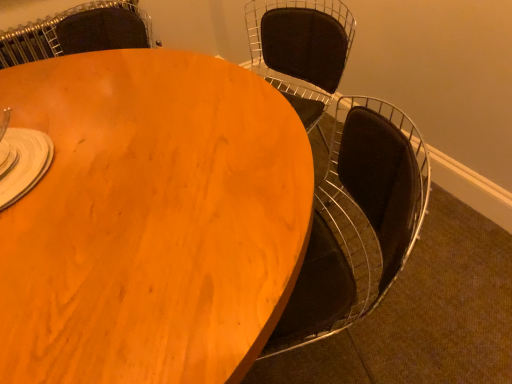
Question: Can matte wood chair at upper center, the first chair positioned from the left, be found inside matte wood table at center?

Choices:
 (A) no
 (B) yes

Answer: (A)

Question: Can you confirm if matte wood table at center is shorter than matte wood chair at upper center, the first chair positioned from the left?

Choices:
 (A) no
 (B) yes

Answer: (A)

Question: Can you confirm if matte wood table at center is wider than matte wood chair at upper center, the first chair positioned from the left?

Choices:
 (A) yes
 (B) no

Answer: (A)

Question: From the image's perspective, does matte wood table at center appear lower than matte wood chair at upper center, the first chair positioned from the left?

Choices:
 (A) no
 (B) yes

Answer: (B)

Question: Considering the relative sizes of matte wood table at center and matte wood chair at upper center, the first chair positioned from the left, in the image provided, is matte wood table at center thinner than matte wood chair at upper center, the first chair positioned from the left,?

Choices:
 (A) no
 (B) yes

Answer: (A)

Question: From the image's perspective, is matte wood table at center positioned above or below matte wood chair at upper center, the first chair positioned from the left?

Choices:
 (A) below
 (B) above

Answer: (A)

Question: Is matte wood table at center spatially inside matte wood chair at upper center, the second chair from the right, or outside of it?

Choices:
 (A) inside
 (B) outside

Answer: (B)

Question: Considering the positions of matte wood table at center and matte wood chair at upper center, the first chair positioned from the left, in the image, is matte wood table at center taller or shorter than matte wood chair at upper center, the first chair positioned from the left,?

Choices:
 (A) tall
 (B) short

Answer: (A)

Question: From a real-world perspective, is matte wood table at center physically located above or below matte wood chair at upper center, the first chair positioned from the left?

Choices:
 (A) above
 (B) below

Answer: (B)

Question: Do you think matte black chair at upper right, positioned as the 2th chair in left-to-right order, is within matte wood chair at upper center, the first chair positioned from the left, or outside of it?

Choices:
 (A) outside
 (B) inside

Answer: (A)

Question: In the image, is matte black chair at upper right, which is the 1th chair from right to left, positioned in front of or behind matte wood chair at upper center, the second chair from the right?

Choices:
 (A) behind
 (B) front

Answer: (B)

Question: Looking at their shapes, would you say matte black chair at upper right, which is the 1th chair from right to left, is wider or thinner than matte wood chair at upper center, the second chair from the right?

Choices:
 (A) thin
 (B) wide

Answer: (A)

Question: Does point (295, 62) appear closer or farther from the camera than point (125, 18)?

Choices:
 (A) closer
 (B) farther

Answer: (A)

Question: Is matte wood table at center taller or shorter than matte black chair at upper right, which is the 1th chair from right to left?

Choices:
 (A) tall
 (B) short

Answer: (A)

Question: Is matte wood table at center spatially inside matte black chair at upper right, positioned as the 2th chair in left-to-right order, or outside of it?

Choices:
 (A) inside
 (B) outside

Answer: (B)